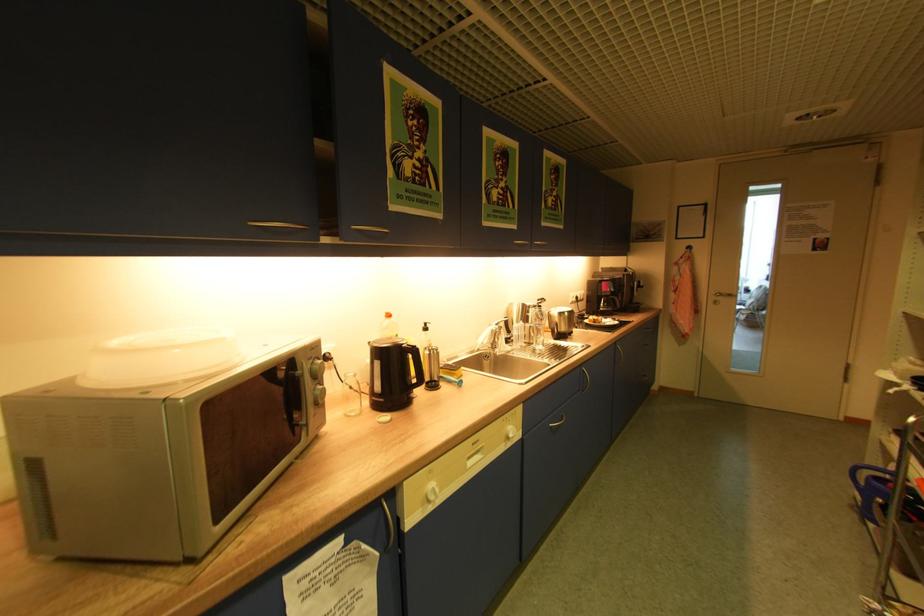
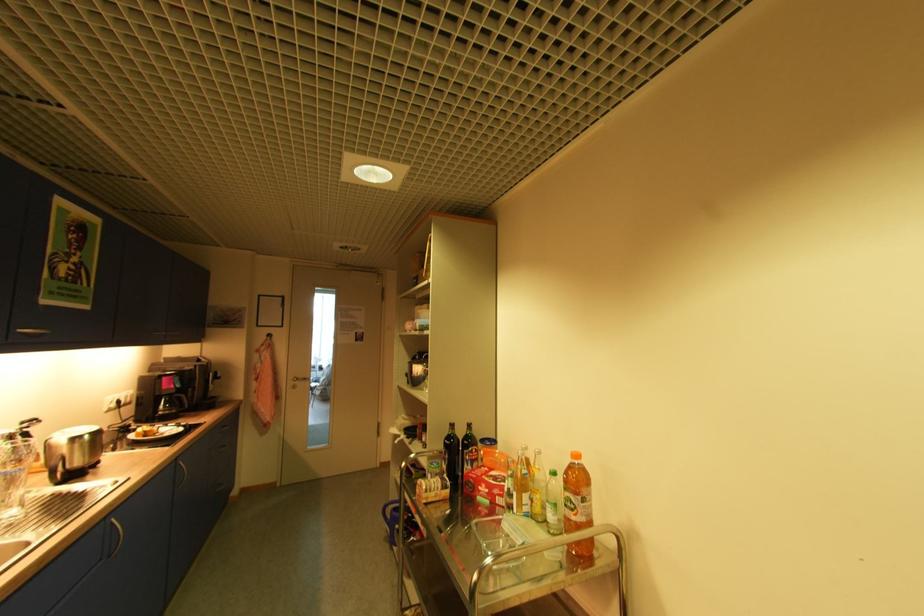
Find the pixel in the second image that matches pixel 586 367 in the first image.

(111, 517)